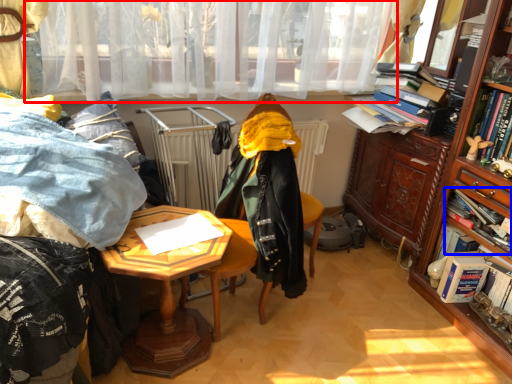
Question: Which object appears closest to the camera in this image, curtain (highlighted by a red box) or book (highlighted by a blue box)?

Choices:
 (A) curtain
 (B) book

Answer: (A)